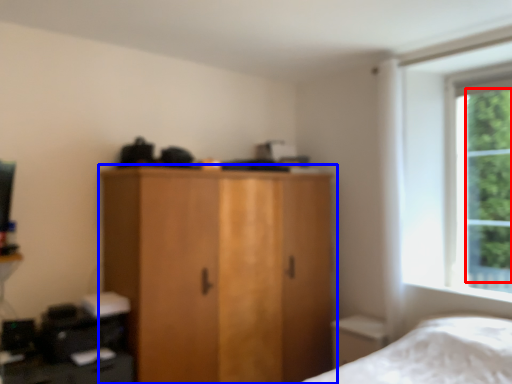
Question: Which of the following is the closest to the observer, tree (highlighted by a red box) or cupboard (highlighted by a blue box)?

Choices:
 (A) tree
 (B) cupboard

Answer: (B)